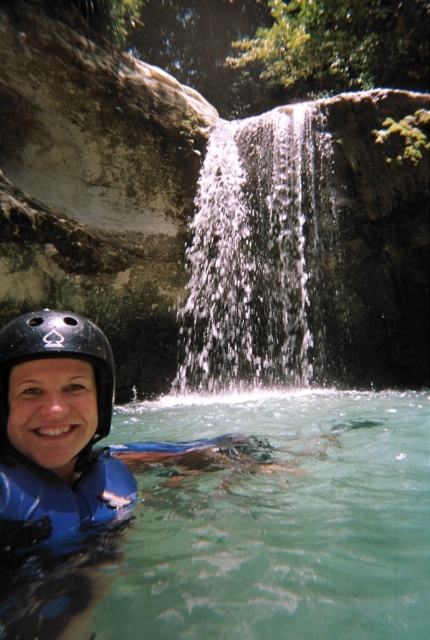
From the picture: Which is more to the left, white frothy water at center or black matte helmet at lower left?

black matte helmet at lower left

Does white frothy water at center appear over black matte helmet at lower left?

Yes, white frothy water at center is above black matte helmet at lower left.

Does point (251, 168) come closer to viewer compared to point (110, 355)?

No.

Identify the location of white frothy water at center. Image resolution: width=430 pixels, height=640 pixels. (261, 257).

Locate an element on the screen. clear blue water at lower center is located at coordinates (279, 524).

Between point (151, 564) and point (64, 330), which one is positioned behind?

The point (151, 564) is more distant.

At what (x,y) coordinates should I click in order to perform the action: click on clear blue water at lower center. Please return your answer as a coordinate pair (x, y). This screenshot has width=430, height=640. Looking at the image, I should click on (279, 524).

Who is higher up, clear blue water at lower center or white frothy water at center?

white frothy water at center

Who is more forward, (387, 413) or (289, 275)?

Point (387, 413)

At what (x,y) coordinates should I click in order to perform the action: click on clear blue water at lower center. Please return your answer as a coordinate pair (x, y). The width and height of the screenshot is (430, 640). Looking at the image, I should click on (279, 524).